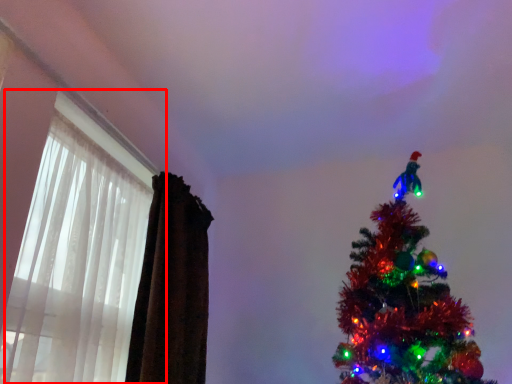
Question: In this image, where is window (annotated by the red box) located relative to curtain?

Choices:
 (A) right
 (B) left

Answer: (B)